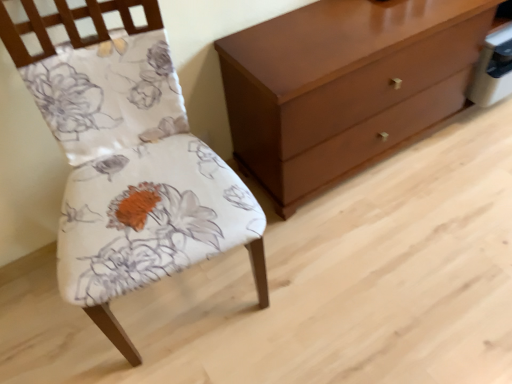
At what (x,y) coordinates should I click in order to perform the action: click on floral fabric chair at left. Please return your answer as a coordinate pair (x, y). The height and width of the screenshot is (384, 512). Looking at the image, I should click on (71, 25).

What do you see at coordinates (71, 25) in the screenshot? I see `floral fabric chair at left` at bounding box center [71, 25].

Locate an element on the screen. Image resolution: width=512 pixels, height=384 pixels. matte brown chest of drawers at right is located at coordinates (344, 85).

What do you see at coordinates (344, 85) in the screenshot? Image resolution: width=512 pixels, height=384 pixels. I see `matte brown chest of drawers at right` at bounding box center [344, 85].

Identify the location of floral fabric chair at left. (71, 25).

Which is more to the right, matte brown chest of drawers at right or floral fabric chair at left?

Positioned to the right is matte brown chest of drawers at right.

Between matte brown chest of drawers at right and floral fabric chair at left, which one is positioned in front?

floral fabric chair at left is more forward.

Is point (426, 63) less distant than point (0, 32)?

No, (426, 63) is behind (0, 32).

From the image's perspective, who appears lower, matte brown chest of drawers at right or floral fabric chair at left?

floral fabric chair at left.

From a real-world perspective, relative to floral fabric chair at left, is matte brown chest of drawers at right vertically above or below?

matte brown chest of drawers at right is situated lower than floral fabric chair at left in the real world.

In the scene shown: Is matte brown chest of drawers at right wider or thinner than floral fabric chair at left?

Clearly, matte brown chest of drawers at right has less width compared to floral fabric chair at left.

Who is taller, matte brown chest of drawers at right or floral fabric chair at left?

floral fabric chair at left is taller.

Between matte brown chest of drawers at right and floral fabric chair at left, which one has smaller size?

floral fabric chair at left.

Based on the photo, choose the correct answer: Is matte brown chest of drawers at right inside floral fabric chair at left or outside it?

matte brown chest of drawers at right is located beyond the bounds of floral fabric chair at left.

Are matte brown chest of drawers at right and floral fabric chair at left far apart?

matte brown chest of drawers at right is actually quite close to floral fabric chair at left.

Is matte brown chest of drawers at right facing away from floral fabric chair at left?

No, floral fabric chair at left is not at the back of matte brown chest of drawers at right.

How far apart are matte brown chest of drawers at right and floral fabric chair at left?

matte brown chest of drawers at right is 65.73 centimeters away from floral fabric chair at left.

Where is `chair above the matte brown chest of drawers at right (from a real-world perspective)`? chair above the matte brown chest of drawers at right (from a real-world perspective) is located at coordinates (71, 25).

Which is more to the right, floral fabric chair at left or matte brown chest of drawers at right?

Positioned to the right is matte brown chest of drawers at right.

Which object is closer to the camera, floral fabric chair at left or matte brown chest of drawers at right?

floral fabric chair at left is more forward.

Considering the points (263, 298) and (402, 2), which point is in front, point (263, 298) or point (402, 2)?

The point (263, 298) is closer.

From the image's perspective, is floral fabric chair at left above or below matte brown chest of drawers at right?

Clearly, from the image's perspective, floral fabric chair at left is below matte brown chest of drawers at right.

From a real-world perspective, is floral fabric chair at left beneath matte brown chest of drawers at right?

No.

Is floral fabric chair at left wider than matte brown chest of drawers at right?

Yes, floral fabric chair at left is wider than matte brown chest of drawers at right.

Who is taller, floral fabric chair at left or matte brown chest of drawers at right?

With more height is floral fabric chair at left.

Between floral fabric chair at left and matte brown chest of drawers at right, which one has larger size?

With larger size is matte brown chest of drawers at right.

Is floral fabric chair at left inside the boundaries of matte brown chest of drawers at right, or outside?

floral fabric chair at left cannot be found inside matte brown chest of drawers at right.

Is floral fabric chair at left far from matte brown chest of drawers at right?

No, floral fabric chair at left is not far from matte brown chest of drawers at right.

Is floral fabric chair at left turned away from matte brown chest of drawers at right?

floral fabric chair at left does not have its back to matte brown chest of drawers at right.

Locate an element on the screen. The width and height of the screenshot is (512, 384). chest of drawers that appears on the right of floral fabric chair at left is located at coordinates (344, 85).

The image size is (512, 384). Find the location of `chest of drawers below the floral fabric chair at left (from a real-world perspective)`. chest of drawers below the floral fabric chair at left (from a real-world perspective) is located at coordinates (344, 85).

Identify the location of chair above the matte brown chest of drawers at right (from a real-world perspective). (71, 25).